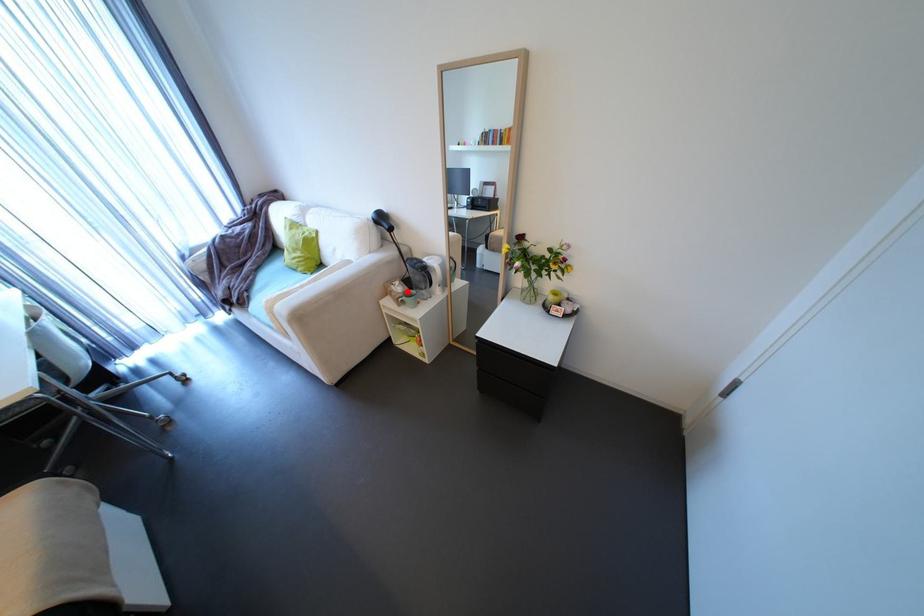
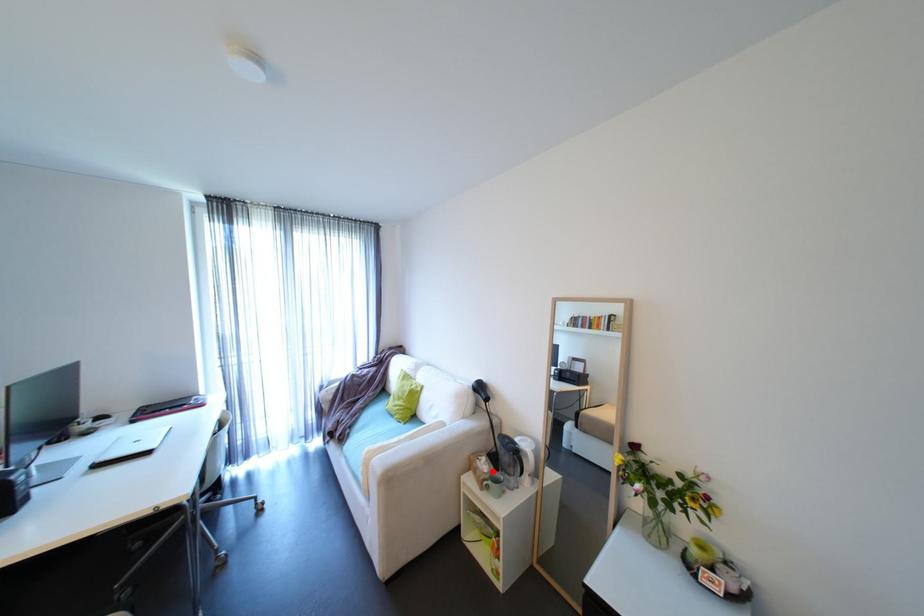
I am providing you with two images of the same scene from different viewpoints. A red point is marked on the first image and another point is marked on the second image. Is the red point in image1 aligned with the point shown in image2?

Yes